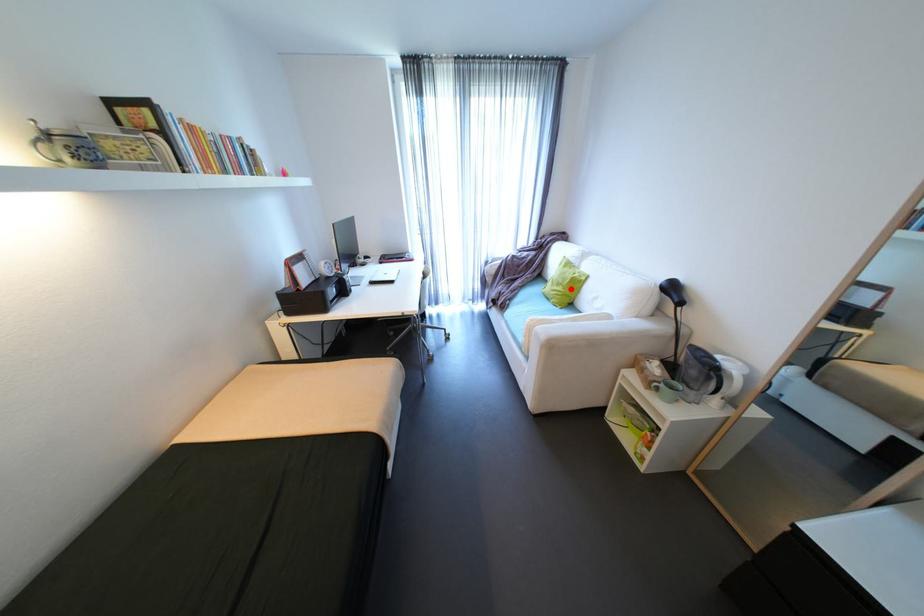
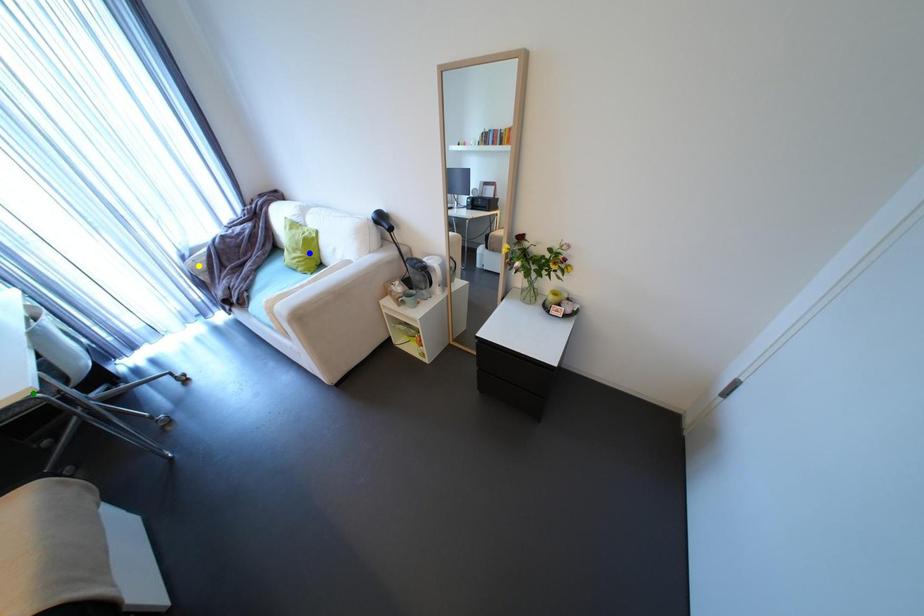
Question: I am providing you with two images of the same scene from different viewpoints. A red point is marked on the first image. You are given multiple points on the second image. In image 2, which mark is for the same physical point as the one in image 1?

Choices:
 (A) blue point
 (B) yellow point
 (C) green point

Answer: (A)